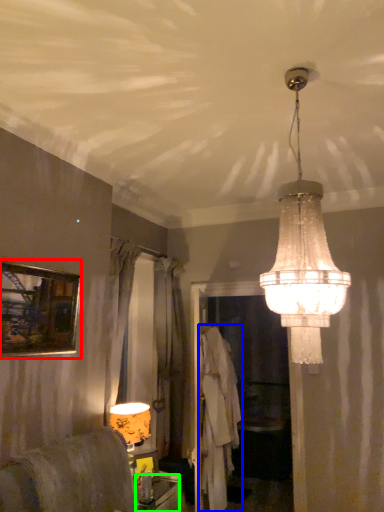
Question: Which is nearer to the picture frame (highlighted by a red box)? robe (highlighted by a blue box) or furniture (highlighted by a green box).

Choices:
 (A) robe
 (B) furniture

Answer: (B)